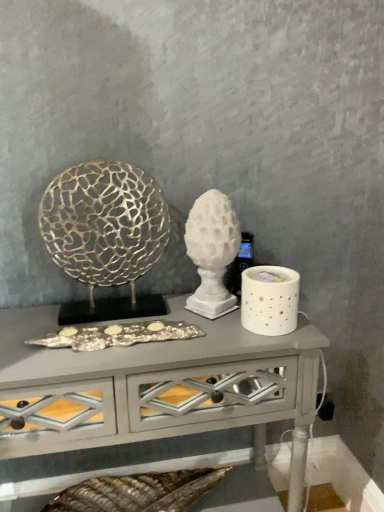
Question: Is gold textured sculpture at left, which ranks as the second sculpture in right-to-left order, next to white ceramic candle holder at right and touching it?

Choices:
 (A) no
 (B) yes

Answer: (A)

Question: Is gold textured sculpture at left, the 1th sculpture positioned from the left, to the right of white ceramic candle holder at right from the viewer's perspective?

Choices:
 (A) no
 (B) yes

Answer: (A)

Question: Considering the relative sizes of gold textured sculpture at left, which ranks as the second sculpture in right-to-left order, and white ceramic candle holder at right in the image provided, is gold textured sculpture at left, which ranks as the second sculpture in right-to-left order, shorter than white ceramic candle holder at right?

Choices:
 (A) yes
 (B) no

Answer: (B)

Question: From a real-world perspective, is gold textured sculpture at left, the 1th sculpture positioned from the left, over white ceramic candle holder at right?

Choices:
 (A) no
 (B) yes

Answer: (B)

Question: From the image's perspective, is gold textured sculpture at left, the 1th sculpture positioned from the left, on white ceramic candle holder at right?

Choices:
 (A) no
 (B) yes

Answer: (B)

Question: Is gold textured sculpture at left, the 1th sculpture positioned from the left, thinner than white ceramic candle holder at right?

Choices:
 (A) yes
 (B) no

Answer: (A)

Question: Is white glossy table at center shorter than white matte sculpture at center, placed as the first sculpture when sorted from right to left?

Choices:
 (A) no
 (B) yes

Answer: (A)

Question: Could you tell me if white glossy table at center is facing white matte sculpture at center, which ranks as the 2th sculpture in left-to-right order?

Choices:
 (A) yes
 (B) no

Answer: (B)

Question: Does white glossy table at center have a smaller size compared to white matte sculpture at center, which ranks as the 2th sculpture in left-to-right order?

Choices:
 (A) no
 (B) yes

Answer: (A)

Question: From the image's perspective, is white glossy table at center located beneath white matte sculpture at center, which ranks as the 2th sculpture in left-to-right order?

Choices:
 (A) yes
 (B) no

Answer: (A)

Question: Can you confirm if white glossy table at center is wider than white matte sculpture at center, placed as the first sculpture when sorted from right to left?

Choices:
 (A) yes
 (B) no

Answer: (A)

Question: Is white matte sculpture at center, which ranks as the 2th sculpture in left-to-right order, completely or partially inside white glossy table at center?

Choices:
 (A) yes
 (B) no

Answer: (B)

Question: Can we say white ceramic candle holder at right lies outside white matte sculpture at center, placed as the first sculpture when sorted from right to left?

Choices:
 (A) yes
 (B) no

Answer: (A)